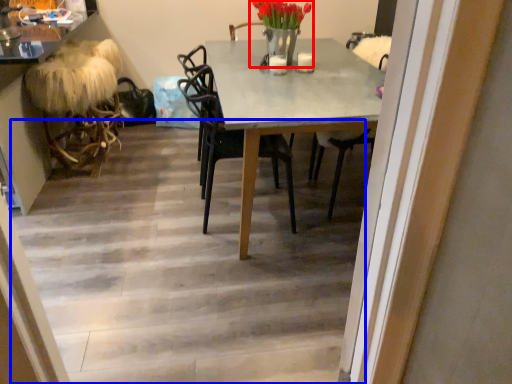
Question: Among these objects, which one is nearest to the camera, floral arrangement (highlighted by a red box) or stairwell (highlighted by a blue box)?

Choices:
 (A) floral arrangement
 (B) stairwell

Answer: (B)